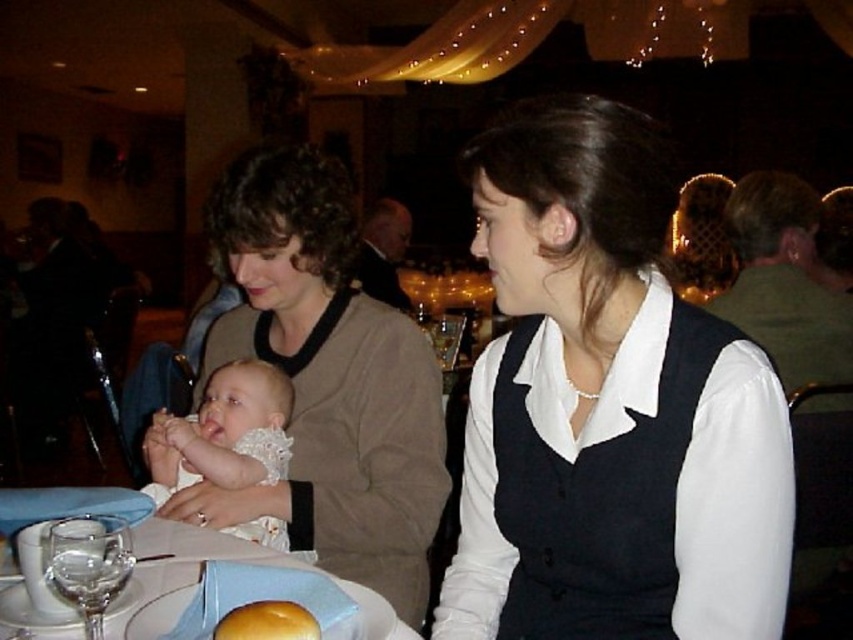
You are a photographer standing at the back of the room. You want to take a closeup photo of the matte beige sweater at center. Can you reach it without moving from your current position if your camera has a 100mm lens?

The matte beige sweater at center and viewer are 1.29 meters apart. A 100mm lens can focus on objects at that distance, so yes, you can take the closeup photo without moving.

Based on the photo, you are at a formal event and notice a matte beige sweater at center and a clear glass wine glass at lower left. Which object is positioned to the right of the other?

The matte beige sweater at center is to the right of the clear glass wine glass at lower left.

You are a photographer at the event and want to capture a closeup of the white porcelain plate at lower left without the matte beige sweater at center appearing in the shot. How should you adjust your camera position?

Move the camera to the left side so that the white porcelain plate at lower left is framed without the matte beige sweater at center blocking the view, since the matte beige sweater at center is to the right of the white porcelain plate at lower left.